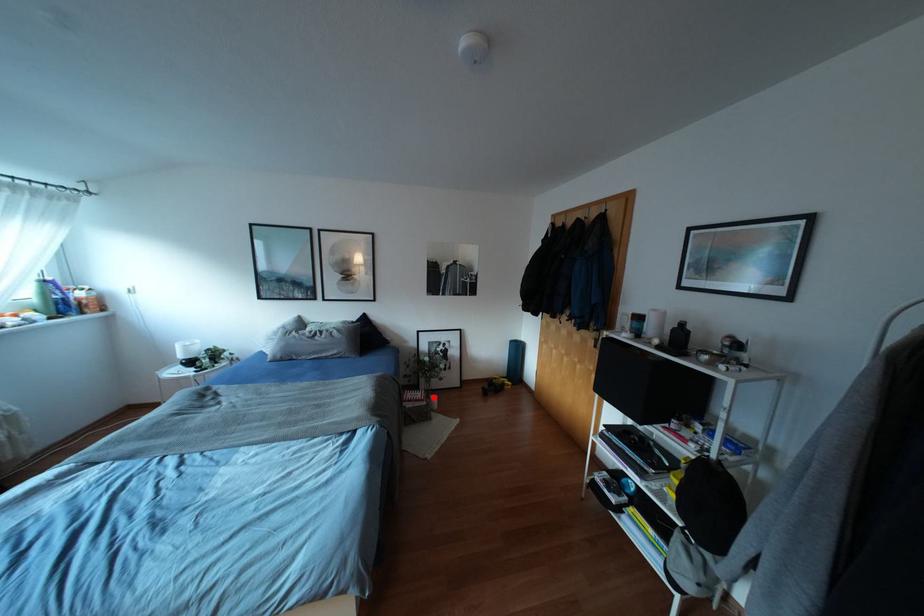
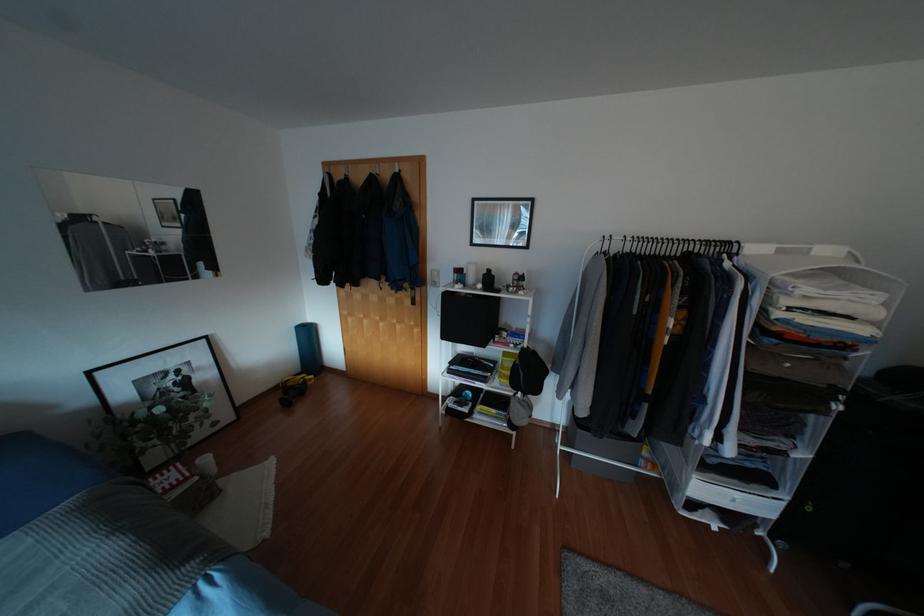
Where in the second image is the point corresponding to the highlighted location from the first image?

(205, 459)